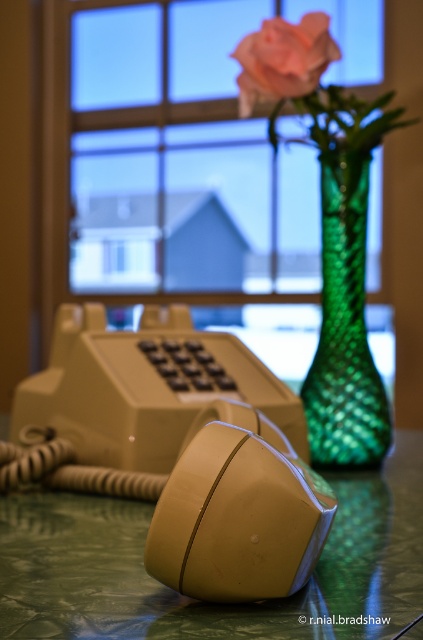
Does point (76, 209) lie behind point (24, 563)?

That is True.

The image size is (423, 640). What do you see at coordinates (184, 156) in the screenshot? I see `transparent glass window at upper center` at bounding box center [184, 156].

Which is behind, point (129, 134) or point (381, 560)?

The point (129, 134) is more distant.

Find the location of a particular element. This screenshot has height=640, width=423. transparent glass window at upper center is located at coordinates (184, 156).

Which of these two, green textured glass vase at center or soft pink rose at center, stands taller?

green textured glass vase at center is taller.

Does green textured glass vase at center appear on the right side of soft pink rose at center?

Yes, green textured glass vase at center is to the right of soft pink rose at center.

Who is more forward, (365,339) or (247,99)?

Point (365,339)

Where is `green textured glass vase at center`? green textured glass vase at center is located at coordinates (345, 330).

Does point (307, 284) lie behind point (334, 508)?

Yes, point (307, 284) is behind point (334, 508).

Is point (228, 22) in front of point (274, 588)?

No.

Which is in front, point (249, 220) or point (297, 572)?

Point (297, 572) is in front.

Find the location of a particular element. transparent glass window at upper center is located at coordinates (184, 156).